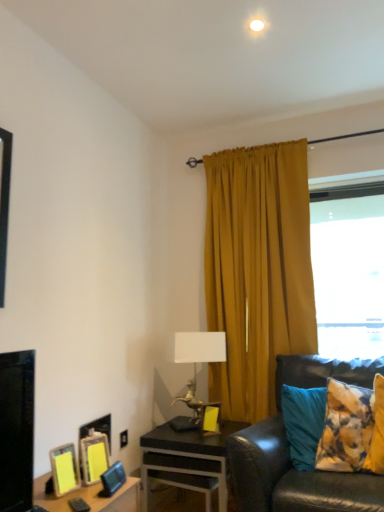
Question: Visually, is metallic horse-shaped lamp at center positioned to the left or to the right of mustard fabric curtain at upper right?

Choices:
 (A) left
 (B) right

Answer: (A)

Question: Considering the positions of point (190, 401) and point (220, 379), is point (190, 401) closer or farther from the camera than point (220, 379)?

Choices:
 (A) farther
 (B) closer

Answer: (B)

Question: Which of these objects is positioned closest to the black glossy desk at lower center?

Choices:
 (A) metallic horse-shaped lamp at center
 (B) black leather couch at right
 (C) transparent glass window at upper right
 (D) mustard fabric curtain at upper right
 (E) yellow matte picture frame at lower left, placed as the 4th picture frame when sorted from front to back

Answer: (B)

Question: Considering the real-world distances, which object is farthest from the yellow matte picture frame at lower left, which is the 5th picture frame from right to left?

Choices:
 (A) yellow matte picture frame at center, acting as the fifth picture frame starting from the left
 (B) mustard fabric curtain at upper right
 (C) yellow matte picture frame at lower left, acting as the third picture frame starting from the right
 (D) black glossy desk at lower center
 (E) black leather couch at right

Answer: (B)